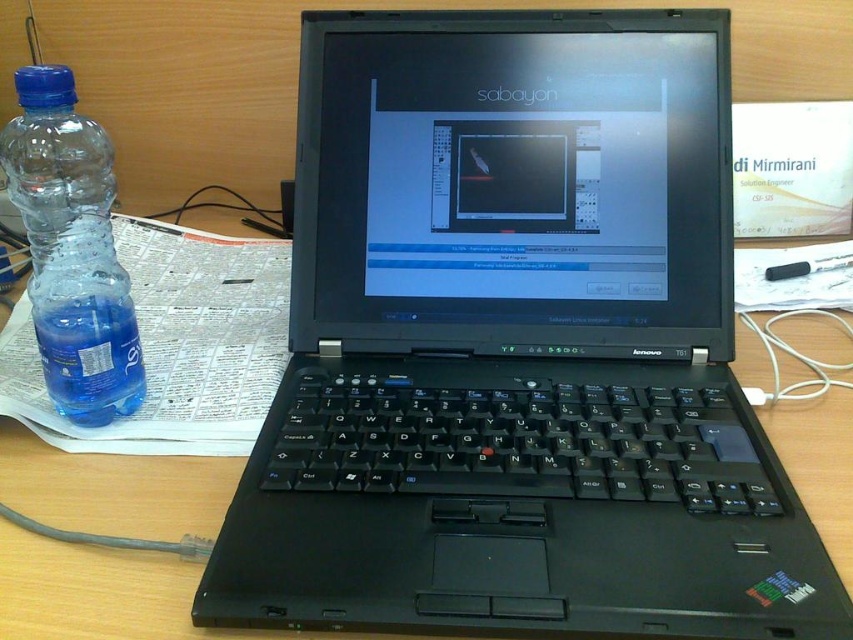
You are organizing items on a desk and see the transparent plastic bottle at left and the transparent plastic water at bottle left. Which item is closer to you?

The transparent plastic bottle at left is closer to the viewer than the transparent plastic water at bottle left.